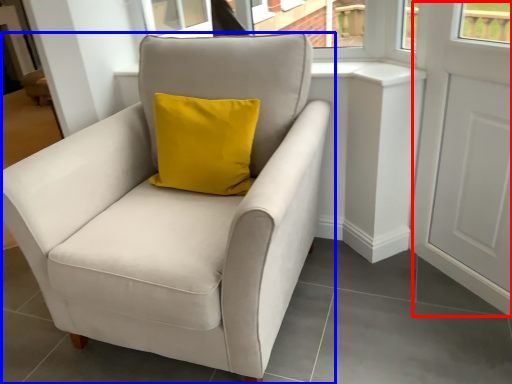
Question: Which of the following is the closest to the observer, screen door (highlighted by a red box) or chair (highlighted by a blue box)?

Choices:
 (A) screen door
 (B) chair

Answer: (B)